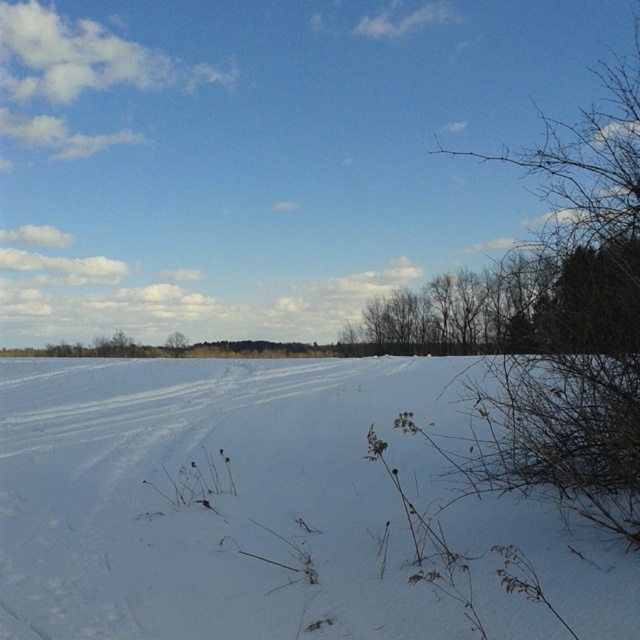
Does point (573, 244) lie in front of point (173, 337)?

Yes, point (573, 244) is in front of point (173, 337).

In order to click on brown bare branches at right in this screenshot , I will do `click(580, 321)`.

Which of these two, white powdery snow at center or brown bare branches at right, stands shorter?

With less height is white powdery snow at center.

Which is in front, point (104, 518) or point (499, 432)?

Positioned in front is point (104, 518).

Image resolution: width=640 pixels, height=640 pixels. Identify the location of white powdery snow at center. (216, 497).

Between white powdery snow at center and green leafy tree at center, which one is positioned higher?

white powdery snow at center

Can you confirm if white powdery snow at center is taller than green leafy tree at center?

No.

At what (x,y) coordinates should I click in order to perform the action: click on white powdery snow at center. Please return your answer as a coordinate pair (x, y). Looking at the image, I should click on (216, 497).